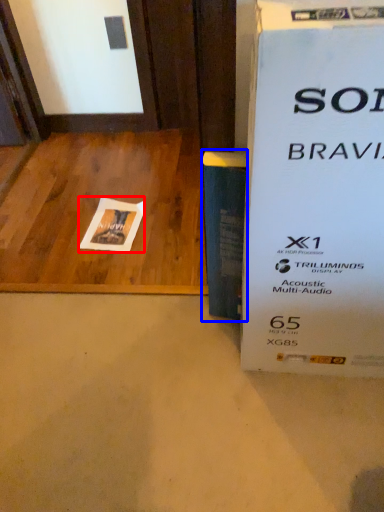
Question: Which object is further to the camera taking this photo, flyer (highlighted by a red box) or paperback book (highlighted by a blue box)?

Choices:
 (A) flyer
 (B) paperback book

Answer: (A)